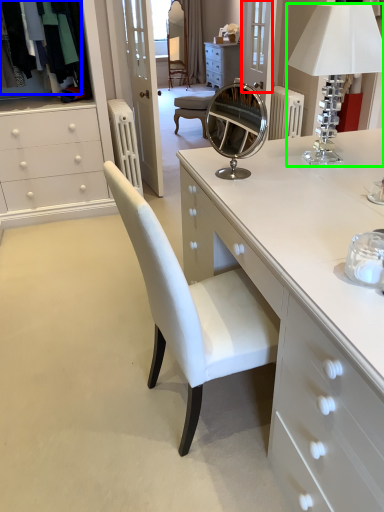
Question: Based on their relative distances, which object is farther from glass door (highlighted by a red box)? Choose from clothing (highlighted by a blue box) and table lamp (highlighted by a green box).

Choices:
 (A) clothing
 (B) table lamp

Answer: (B)